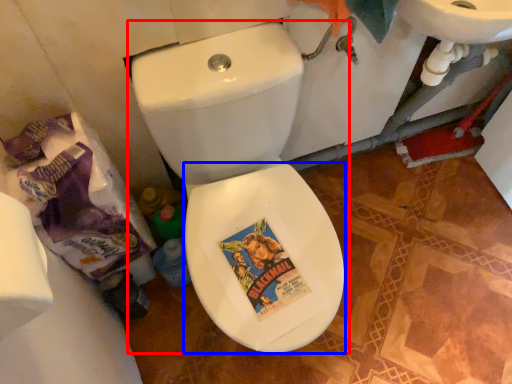
Question: Which of the following is the closest to the observer, toilet (highlighted by a red box) or bidet (highlighted by a blue box)?

Choices:
 (A) toilet
 (B) bidet

Answer: (A)